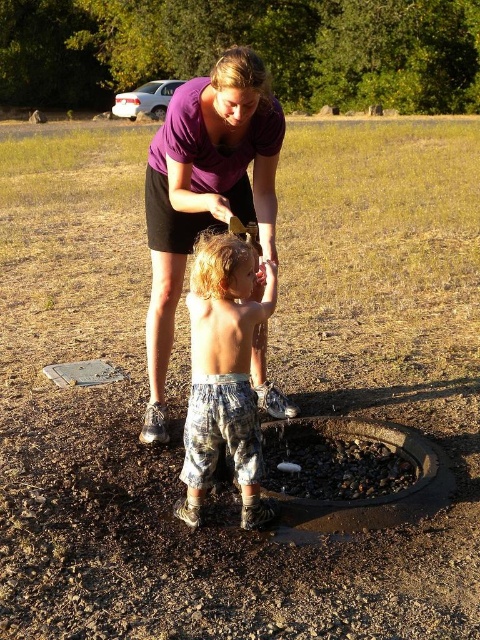
You are standing in the park and see the point marked at coordinates (204, 189). What object is located at this point?

The point at coordinates (204, 189) marks the purple cotton shirt at upper center.

You are a parent trying to locate your child who is near a water feature in the park. You see the rusty metal manhole at center and the metallic gray hole at lower center. Which object is closer to the right side of the scene?

The rusty metal manhole at center is closer to the right side of the scene because it is positioned to the right of the metallic gray hole at lower center.